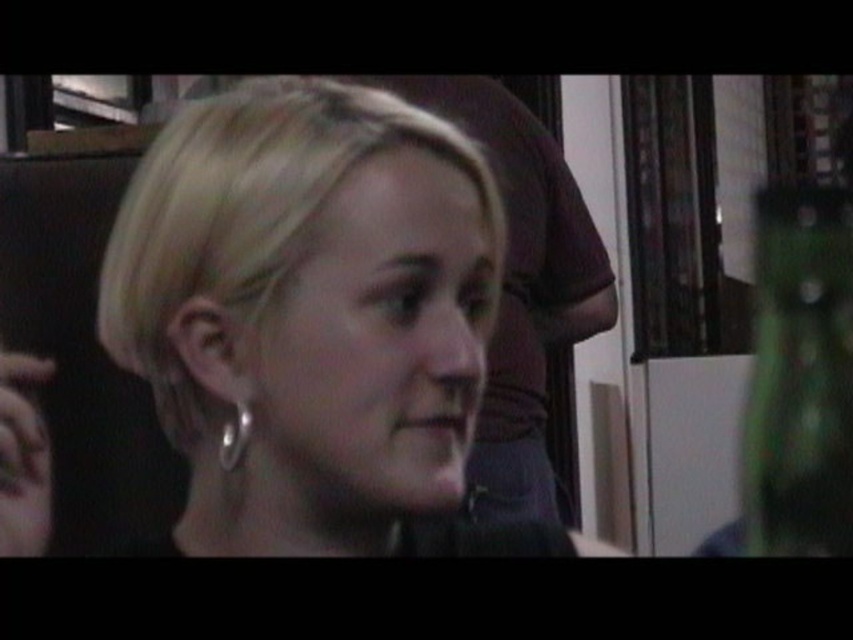
Does blonde hair at center have a greater height compared to smooth skin face at center?

In fact, blonde hair at center may be shorter than smooth skin face at center.

Which is in front, point (316, 483) or point (538, 472)?

Point (316, 483) is in front.

Is point (125, 236) behind point (515, 385)?

No, (125, 236) is closer to viewer.

This screenshot has width=853, height=640. Identify the location of blonde hair at center. (308, 308).

Consider the image. Is blonde hair at center above green glass bottle at right?

Yes.

Between blonde hair at center and green glass bottle at right, which one appears on the left side from the viewer's perspective?

blonde hair at center

Where is `blonde hair at center`? Image resolution: width=853 pixels, height=640 pixels. blonde hair at center is located at coordinates (308, 308).

Measure the distance between point (541, 500) and camera.

Point (541, 500) and camera are 1.19 meters apart.

Is point (434, 100) behind point (836, 308)?

No, it is in front of (836, 308).

Where is `smooth skin face at center`? The width and height of the screenshot is (853, 640). smooth skin face at center is located at coordinates (521, 289).

At what (x,y) coordinates should I click in order to perform the action: click on smooth skin face at center. Please return your answer as a coordinate pair (x, y). Image resolution: width=853 pixels, height=640 pixels. Looking at the image, I should click on (521, 289).